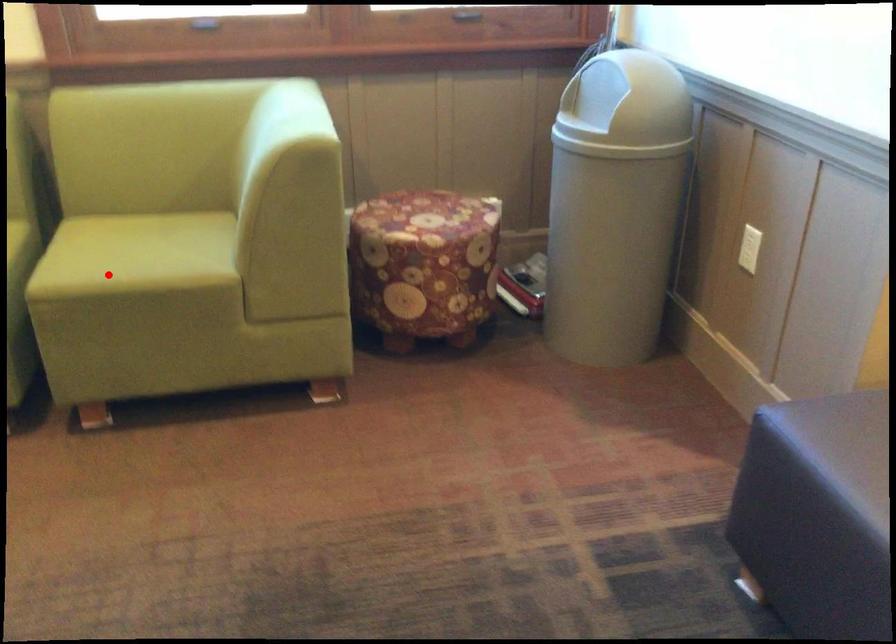
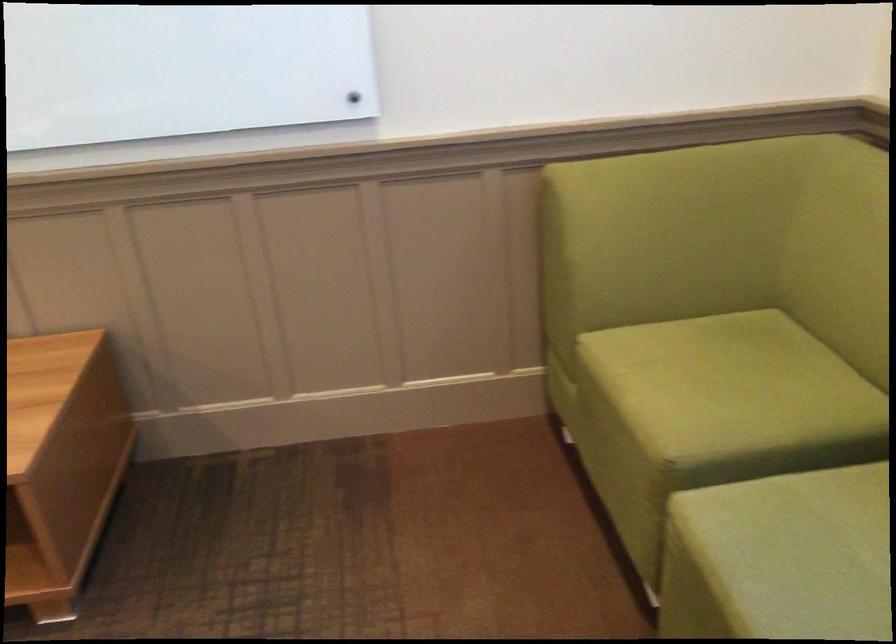
Find the pixel in the second image that matches the highlighted location in the first image.

(780, 558)